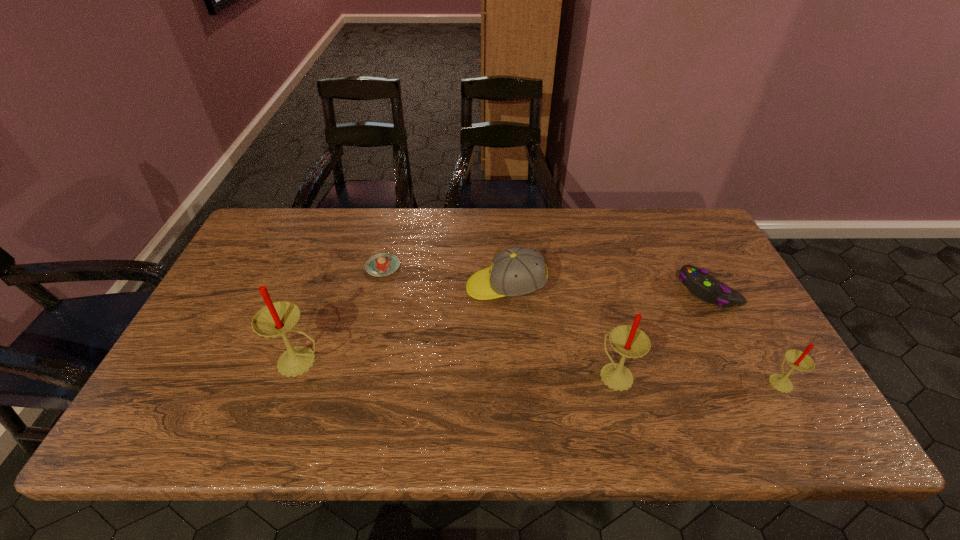
Please mark a free spot for a new candle to balance the arrangement. Please provide its 2D coordinates. Your answer should be formatted as a tuple, i.e. [(x, y)], where the tuple contains the x and y coordinates of a point satisfying the conditions above.

[(457, 368)]